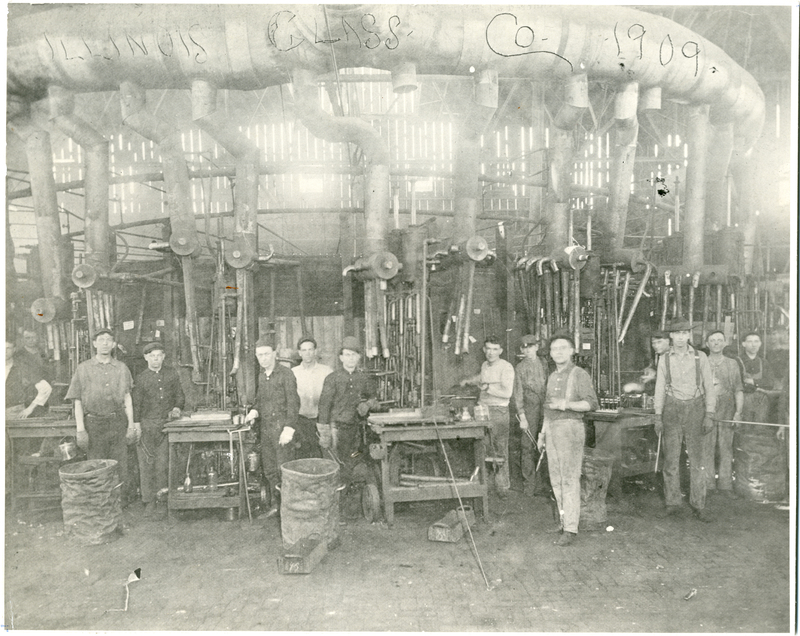
This screenshot has width=800, height=636. Find the location of `brick floor`. brick floor is located at coordinates (402, 596).